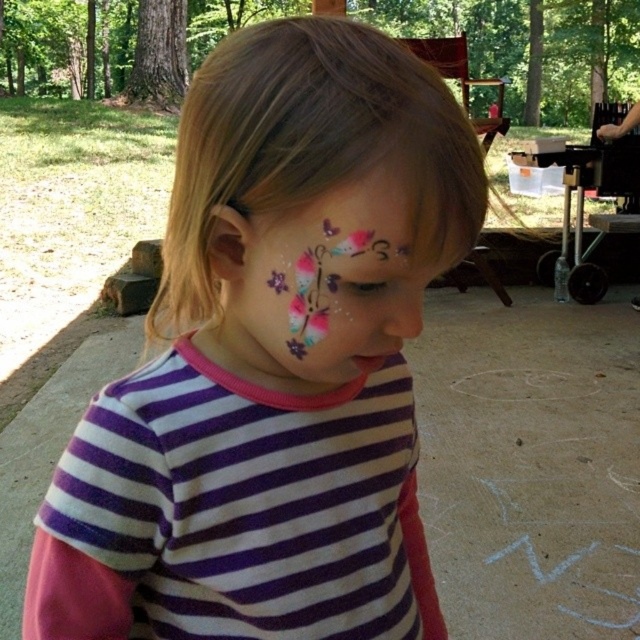
Does pastel glitter butterflies at center appear under matte pink nose at center?

Incorrect, pastel glitter butterflies at center is not positioned below matte pink nose at center.

Which is in front, point (323, 314) or point (396, 301)?

Point (323, 314)

You are a GUI agent. You are given a task and a screenshot of the screen. Output one action in this format:
    pyautogui.click(x=<x>, y=<y>)
    Task: Click on the pastel glitter butterflies at center
    This screenshot has height=640, width=640.
    Given the screenshot: What is the action you would take?
    326,275

Locate an element on the screen. pastel glitter butterflies at center is located at coordinates (326, 275).

Does matte white face paint at center have a larger size compared to matte pink nose at center?

Indeed, matte white face paint at center has a larger size compared to matte pink nose at center.

Image resolution: width=640 pixels, height=640 pixels. Describe the element at coordinates (272, 362) in the screenshot. I see `matte white face paint at center` at that location.

You are a GUI agent. You are given a task and a screenshot of the screen. Output one action in this format:
    pyautogui.click(x=<x>, y=<y>)
    Task: Click on the matte white face paint at center
    This screenshot has width=640, height=640.
    Given the screenshot: What is the action you would take?
    pyautogui.click(x=272, y=362)

Is matte white face paint at center in front of pastel glitter butterflies at center?

Yes, matte white face paint at center is in front of pastel glitter butterflies at center.

Does point (364, 349) come behind point (401, 173)?

That is True.

You are a GUI agent. You are given a task and a screenshot of the screen. Output one action in this format:
    pyautogui.click(x=<x>, y=<y>)
    Task: Click on the matte white face paint at center
    The height and width of the screenshot is (640, 640).
    Given the screenshot: What is the action you would take?
    pyautogui.click(x=272, y=362)